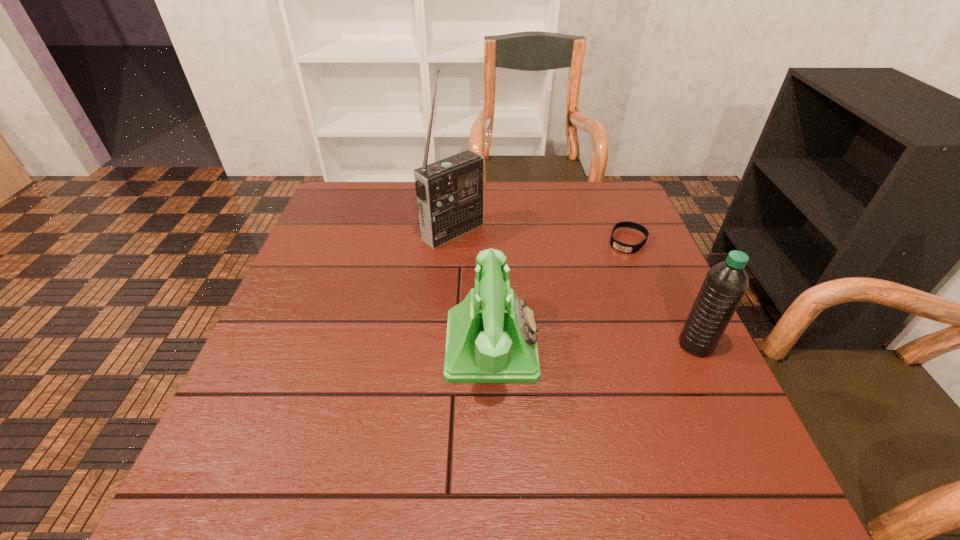
You are a GUI agent. You are given a task and a screenshot of the screen. Output one action in this format:
    pyautogui.click(x=<x>, y=<y>)
    Task: Click on the second shortest object
    The image size is (960, 540).
    Given the screenshot: What is the action you would take?
    pyautogui.click(x=491, y=337)

Where is `the second tallest object`? the second tallest object is located at coordinates (725, 284).

I want to click on radio receiver, so click(450, 193).

This screenshot has width=960, height=540. What are the coordinates of `wristband` in the screenshot? It's located at (630, 249).

I want to click on free location located 0.140m on the dial of the telephone, so click(x=605, y=345).

Find the location of a particular element. Image resolution: width=960 pixels, height=540 pixels. free space located 0.160m on the left of the third shortest object is located at coordinates (603, 345).

This screenshot has width=960, height=540. What are the coordinates of `vacant space situated 0.170m on the display of the tallest object` in the screenshot? It's located at (516, 278).

In order to click on free space located 0.370m on the display of the tallest object in this screenshot , I will do `click(579, 325)`.

Where is `vacant space located 0.270m on the display of the tallest object`? This screenshot has height=540, width=960. vacant space located 0.270m on the display of the tallest object is located at coordinates (545, 300).

Image resolution: width=960 pixels, height=540 pixels. Find the location of `free space located 0.230m on the display of the shortest object`. free space located 0.230m on the display of the shortest object is located at coordinates (590, 306).